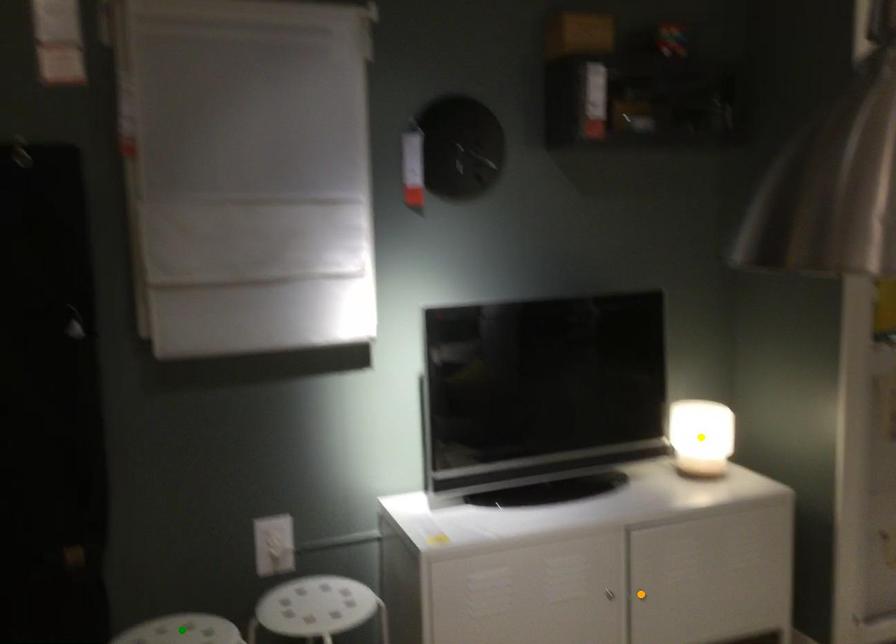
From the picture: Order these from farthest to nearest:
1. orange point
2. yellow point
3. green point

yellow point → orange point → green point